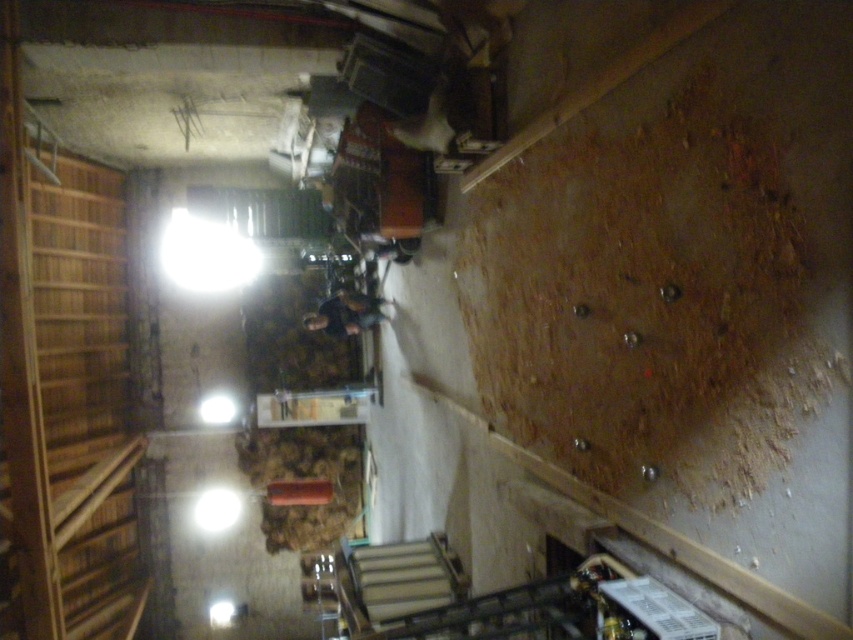
What do you see at coordinates (71, 394) in the screenshot? The image size is (853, 640). I see `wooden stairs at left` at bounding box center [71, 394].

This screenshot has height=640, width=853. What are the coordinates of `wooden stairs at left` in the screenshot? It's located at (71, 394).